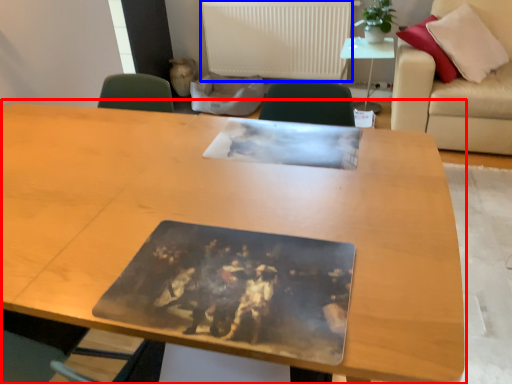
Question: Which point is further to the camera, table (highlighted by a red box) or radiator (highlighted by a blue box)?

Choices:
 (A) table
 (B) radiator

Answer: (B)